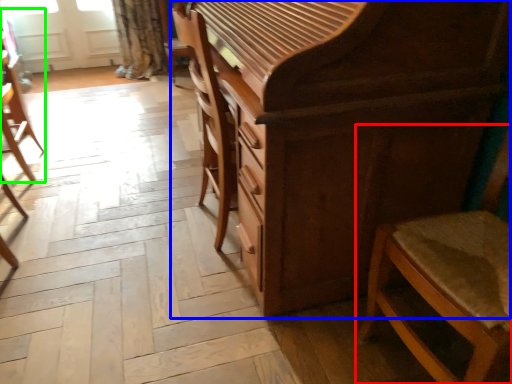
Question: Which is nearer to the chair (highlighted by a red box)? chest of drawers (highlighted by a blue box) or chair (highlighted by a green box).

Choices:
 (A) chest of drawers
 (B) chair

Answer: (A)